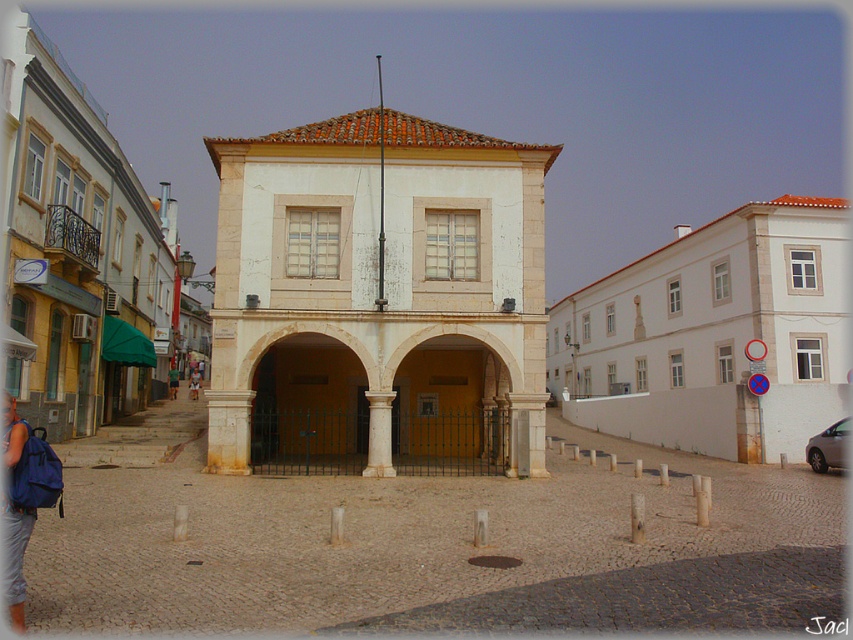
Can you confirm if green fabric bag at center is positioned above brown leather bag at center?

Yes, green fabric bag at center is above brown leather bag at center.

Which is in front, point (177, 387) or point (194, 400)?

Point (194, 400) is in front.

At what (x,y) coordinates should I click in order to perform the action: click on green fabric bag at center. Please return your answer as a coordinate pair (x, y). The image size is (853, 640). Looking at the image, I should click on (172, 381).

Which is above, brown stone archway at center or white marble column at center?

white marble column at center is above.

Is brown stone archway at center above white marble column at center?

Incorrect, brown stone archway at center is not positioned above white marble column at center.

Which is in front, point (270, 445) or point (375, 445)?

Positioned in front is point (375, 445).

Locate an element on the screen. Image resolution: width=853 pixels, height=640 pixels. brown stone archway at center is located at coordinates (309, 408).

Does yellow matte archway at center have a lesser width compared to green fabric bag at center?

In fact, yellow matte archway at center might be wider than green fabric bag at center.

Can you confirm if yellow matte archway at center is smaller than green fabric bag at center?

No.

Based on the photo, who is more distant from viewer, (485, 472) or (171, 392)?

Positioned behind is point (171, 392).

You are a GUI agent. You are given a task and a screenshot of the screen. Output one action in this format:
    pyautogui.click(x=<x>, y=<y>)
    Task: Click on the yellow matte archway at center
    
    Given the screenshot: What is the action you would take?
    pos(450,410)